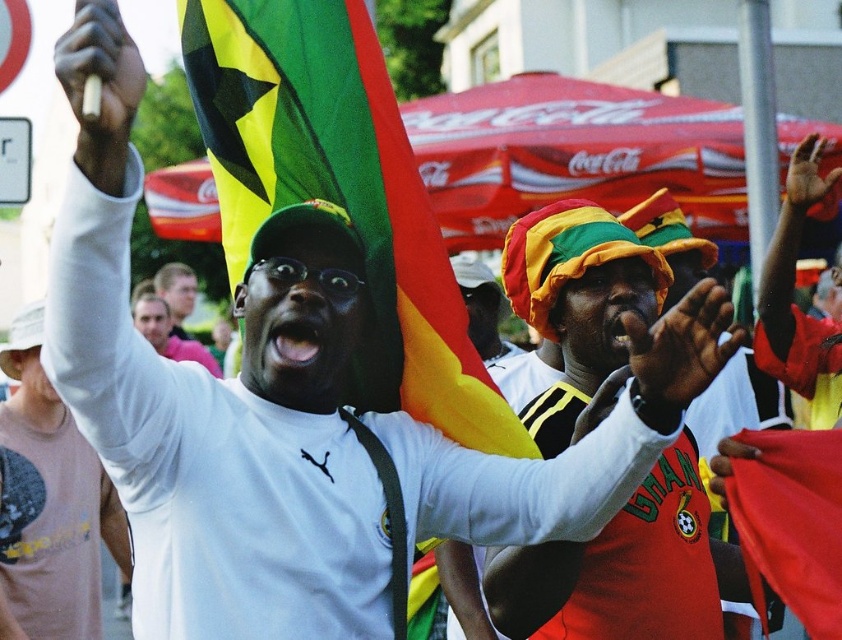
Is polyester flag at upper center taller than red fabric flag at upper center?

Indeed, polyester flag at upper center has a greater height compared to red fabric flag at upper center.

Does polyester flag at upper center have a lesser height compared to red fabric flag at upper center?

Incorrect, polyester flag at upper center's height does not fall short of red fabric flag at upper center's.

The image size is (842, 640). Identify the location of polyester flag at upper center. (340, 193).

Which is above, white matte shirt at upper center or red fabric flag at upper center?

red fabric flag at upper center is higher up.

Consider the image. Can you confirm if white matte shirt at upper center is taller than red fabric flag at upper center?

Yes, white matte shirt at upper center is taller than red fabric flag at upper center.

Who is more distant from viewer, (44,468) or (822,532)?

The point (44,468) is more distant.

The image size is (842, 640). Identify the location of white matte shirt at upper center. (49, 504).

Between polyester flag at upper center and white matte shirt at upper center, which one has more height?

Standing taller between the two is white matte shirt at upper center.

Locate an element on the screen. polyester flag at upper center is located at coordinates (340, 193).

Between point (510, 412) and point (62, 632), which one is positioned in front?

Point (510, 412) is more forward.

The height and width of the screenshot is (640, 842). I want to click on polyester flag at upper center, so click(340, 193).